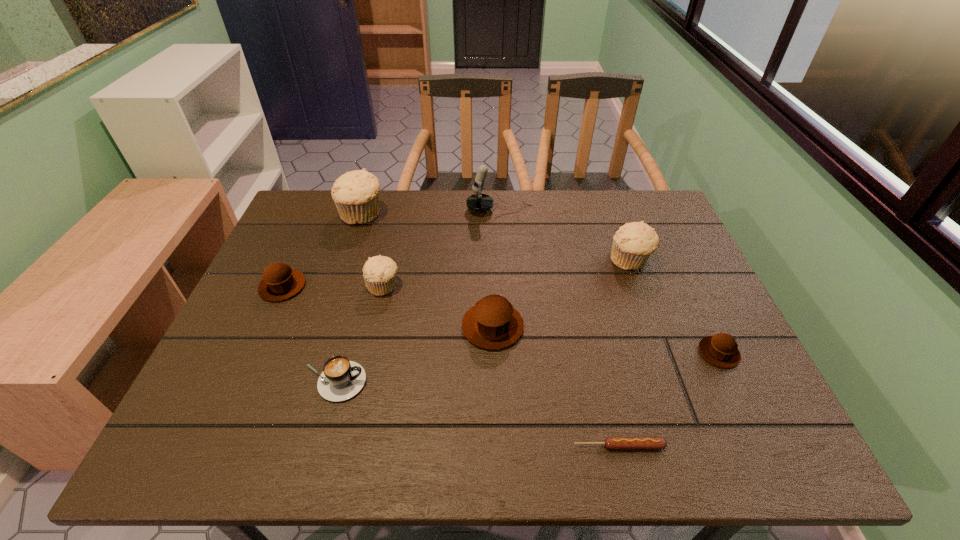
The width and height of the screenshot is (960, 540). I want to click on the leftmost brown muffin, so click(279, 282).

Find the location of `cappuccino`. cappuccino is located at coordinates (341, 379).

Identify the location of the rightmost brown muffin. This screenshot has width=960, height=540. (721, 350).

Locate an element on the screen. The image size is (960, 540). the rightmost muffin is located at coordinates 721,350.

You are a GUI agent. You are given a task and a screenshot of the screen. Output one action in this format:
    pyautogui.click(x=<x>, y=<y>)
    Task: Click on the brown sausage
    The height and width of the screenshot is (540, 960).
    Given the screenshot: What is the action you would take?
    pyautogui.click(x=610, y=442)

Find the location of a particular element. This screenshot has width=960, height=540. the nearest object is located at coordinates (610, 442).

Image resolution: width=960 pixels, height=540 pixels. I want to click on free location located 0.140m on the right of the white microphone, so click(x=576, y=210).

Image resolution: width=960 pixels, height=540 pixels. I want to click on vacant space situated on the right of the farthest muffin, so click(x=429, y=215).

The image size is (960, 540). Find the location of `vacant area located 0.350m on the left of the second muffin from right to left`. vacant area located 0.350m on the left of the second muffin from right to left is located at coordinates (484, 261).

Locate an element on the screen. Image resolution: width=960 pixels, height=540 pixels. free region located on the left of the smallest beige muffin is located at coordinates (318, 286).